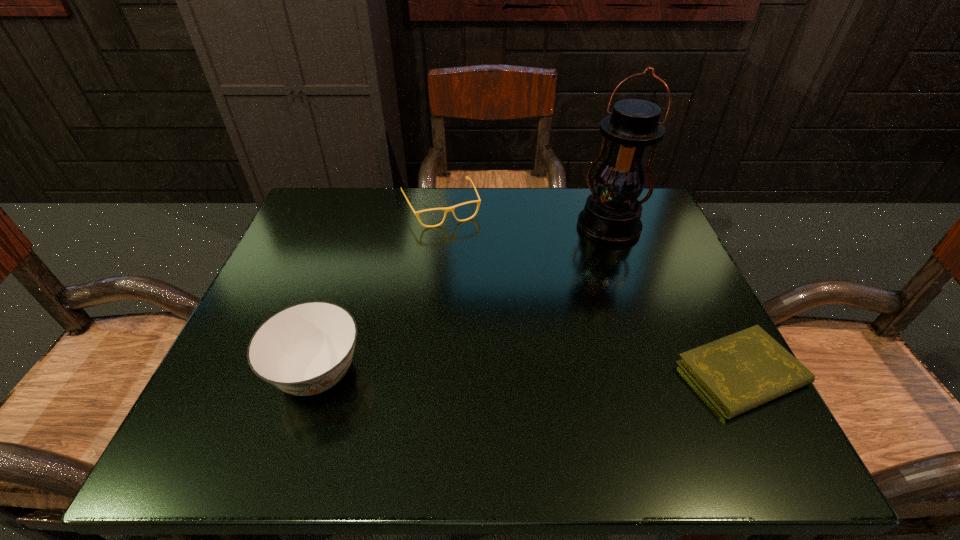
Identify the location of object located at the far right corner. This screenshot has height=540, width=960. (611, 215).

Find the location of `object present at the near right corner`. object present at the near right corner is located at coordinates (737, 373).

The width and height of the screenshot is (960, 540). In the image, there is a desktop. Identify the location of vacant space at the far edge. (394, 204).

I want to click on free region at the near edge, so click(607, 375).

Locate an element on the screen. Image resolution: width=960 pixels, height=540 pixels. vacant position at the left edge of the desktop is located at coordinates (255, 316).

Identify the location of free space at the right edge. This screenshot has height=540, width=960. (670, 316).

Locate an element on the screen. blank space at the far left corner is located at coordinates (330, 191).

The image size is (960, 540). In order to click on vacant area that lies between the diary and the second tallest object in this screenshot , I will do `click(530, 373)`.

Where is `vacant area that lies between the diary and the lantern`? vacant area that lies between the diary and the lantern is located at coordinates (675, 300).

The height and width of the screenshot is (540, 960). I want to click on empty location between the diary and the third shortest object, so click(530, 373).